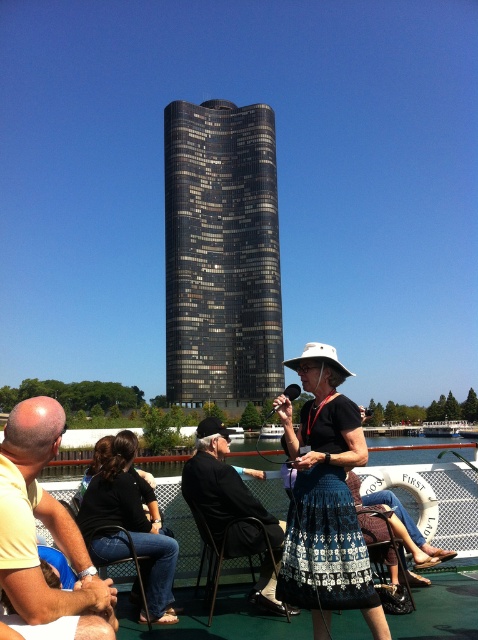
Question: Which object appears closest to the camera in this image?

Choices:
 (A) metallic black chair at lower left
 (B) white mesh ferry at center
 (C) black glass building at center
 (D) yellow t-shirt at lower left

Answer: (D)

Question: Does black glass building at center appear on the left side of white mesh ferry at center?

Choices:
 (A) no
 (B) yes

Answer: (B)

Question: Which of the following is the farthest from the observer?

Choices:
 (A) black leather jacket at center
 (B) white mesh ferry at center
 (C) yellow t-shirt at lower left
 (D) metallic black chair at lower left

Answer: (B)

Question: Among these objects, which one is farthest from the camera?

Choices:
 (A) metallic black chair at lower left
 (B) black denim jeans at lower left
 (C) white mesh ferry at center

Answer: (C)

Question: Can you confirm if yellow t-shirt at lower left is wider than white mesh ferry at center?

Choices:
 (A) no
 (B) yes

Answer: (A)

Question: Does black leather jacket at center have a lesser width compared to white mesh ferry at center?

Choices:
 (A) no
 (B) yes

Answer: (B)